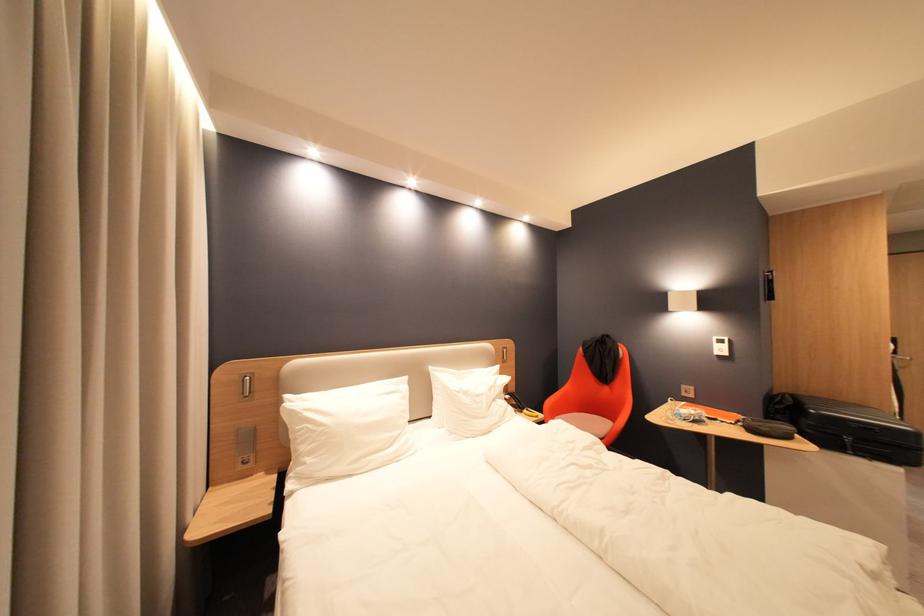
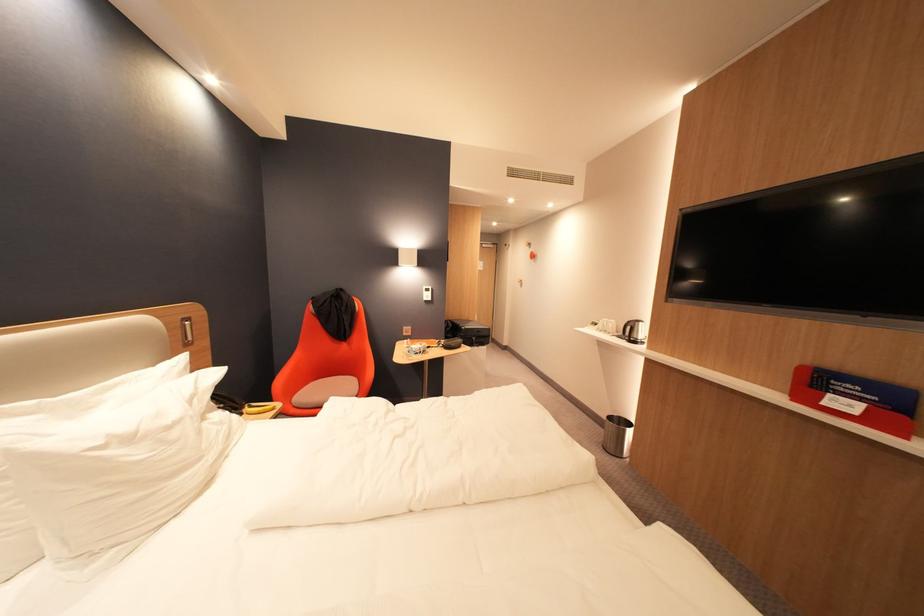
Question: The images are taken continuously from a first-person perspective. In which direction is your viewpoint rotating?

Choices:
 (A) Left
 (B) Right
 (C) Up
 (D) Down

Answer: (B)